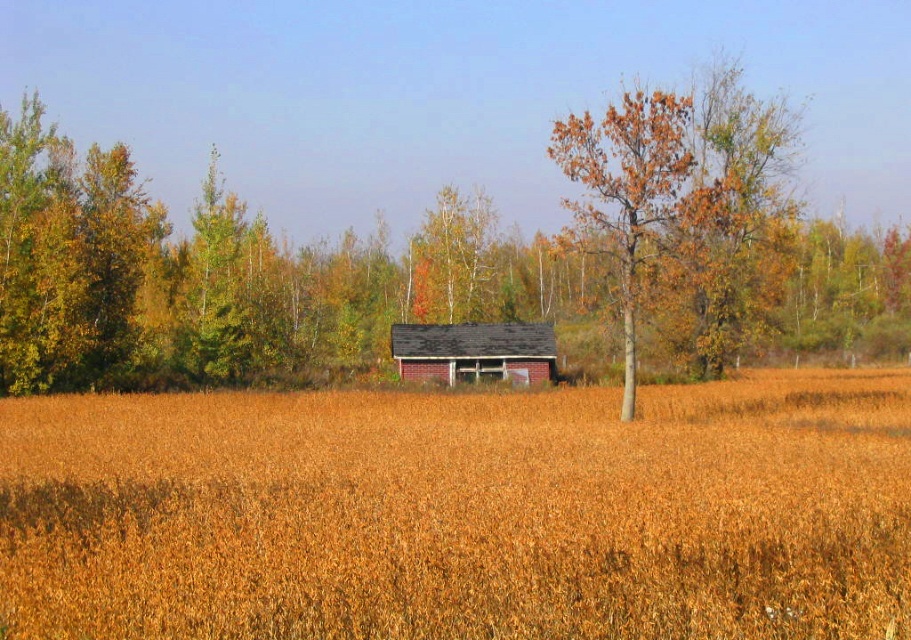
Question: Which point is closer to the camera?

Choices:
 (A) brown textured tree at center
 (B) brown matte wheat field at center

Answer: (B)

Question: Does brown matte wheat field at center lie behind brown textured tree at center?

Choices:
 (A) no
 (B) yes

Answer: (A)

Question: Can you confirm if brown leafy tree at center is wider than dark gray shingles at center?

Choices:
 (A) no
 (B) yes

Answer: (B)

Question: Which is nearer to the brown textured tree at center?

Choices:
 (A) brown leafy tree at center
 (B) dark gray shingles at center
 (C) brown matte wheat field at center

Answer: (C)

Question: Does brown matte wheat field at center appear on the left side of brown leafy tree at center?

Choices:
 (A) yes
 (B) no

Answer: (A)

Question: Based on their relative distances, which object is farther from the brown matte wheat field at center?

Choices:
 (A) brown textured tree at center
 (B) brown leafy tree at center
 (C) dark gray shingles at center

Answer: (C)